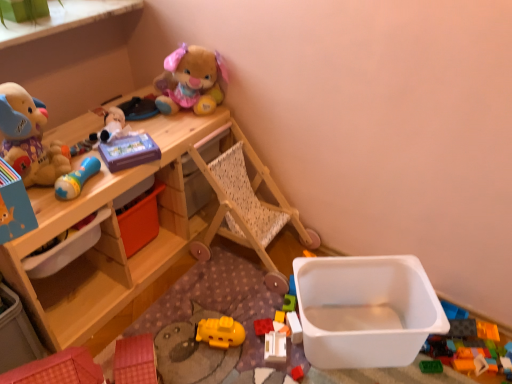
Question: Would you say wooden table at upper left is part of white plastic container at lower right, which is the 2th storage box from left to right,'s contents?

Choices:
 (A) yes
 (B) no

Answer: (B)

Question: Considering the relative sizes of white plastic container at lower right, which is the 2th storage box in top-to-bottom order, and wooden table at upper left in the image provided, is white plastic container at lower right, which is the 2th storage box in top-to-bottom order, smaller than wooden table at upper left?

Choices:
 (A) no
 (B) yes

Answer: (B)

Question: Considering the relative sizes of white plastic container at lower right, which is the 2th storage box in top-to-bottom order, and wooden table at upper left in the image provided, is white plastic container at lower right, which is the 2th storage box in top-to-bottom order, wider than wooden table at upper left?

Choices:
 (A) no
 (B) yes

Answer: (A)

Question: From the image's perspective, is white plastic container at lower right, the 1th storage box ordered from the bottom, located beneath wooden table at upper left?

Choices:
 (A) no
 (B) yes

Answer: (B)

Question: Is white plastic container at lower right, which is the 2th storage box in top-to-bottom order, facing away from wooden table at upper left?

Choices:
 (A) yes
 (B) no

Answer: (B)

Question: Does white plastic container at lower right, which is the 2th storage box from left to right, have a lesser width compared to wooden table at upper left?

Choices:
 (A) no
 (B) yes

Answer: (B)

Question: Does translucent plastic blocks at center, which ranks as the seventh toy in top-to-bottom order, appear on the left side of rubberized red block at center, the second toy from the bottom?

Choices:
 (A) yes
 (B) no

Answer: (B)

Question: Does translucent plastic blocks at center, which ranks as the seventh toy in top-to-bottom order, have a lesser width compared to rubberized red block at center, the eighth toy in the top-to-bottom sequence?

Choices:
 (A) no
 (B) yes

Answer: (B)

Question: Is translucent plastic blocks at center, which ranks as the seventh toy in top-to-bottom order, outside rubberized red block at center, the eighth toy in the top-to-bottom sequence?

Choices:
 (A) no
 (B) yes

Answer: (B)

Question: From the image's perspective, is translucent plastic blocks at center, which ranks as the seventh toy in top-to-bottom order, located beneath rubberized red block at center, the second toy from the bottom?

Choices:
 (A) no
 (B) yes

Answer: (A)

Question: Does translucent plastic blocks at center, the 3th toy when ordered from bottom to top, appear on the right side of rubberized red block at center, the eighth toy in the top-to-bottom sequence?

Choices:
 (A) yes
 (B) no

Answer: (A)

Question: Is translucent plastic blocks at center, which ranks as the seventh toy in top-to-bottom order, bigger than rubberized red block at center, the eighth toy in the top-to-bottom sequence?

Choices:
 (A) yes
 (B) no

Answer: (A)

Question: Is white plastic container at lower right, the first storage box positioned from the right, bigger than blue rubber rattle at upper left, the fourth toy positioned from the top?

Choices:
 (A) yes
 (B) no

Answer: (A)